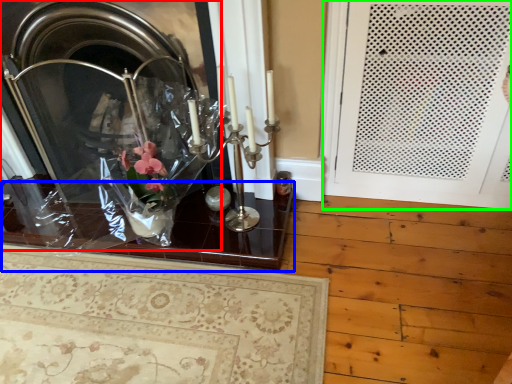
Question: Considering the real-world distances, which object is farthest from fireplace (highlighted by a red box)? table (highlighted by a blue box) or door (highlighted by a green box)?

Choices:
 (A) table
 (B) door

Answer: (B)